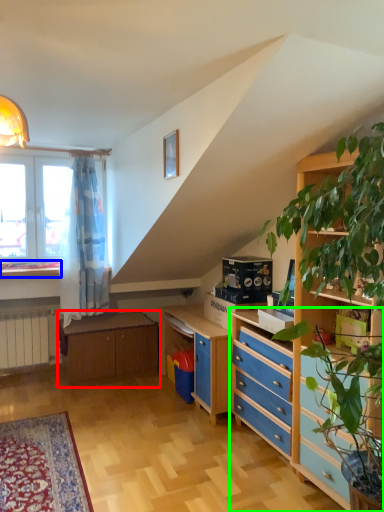
Question: Considering the real-world distances, which object is farthest from table (highlighted by a red box)? window sill (highlighted by a blue box) or chest of drawers (highlighted by a green box)?

Choices:
 (A) window sill
 (B) chest of drawers

Answer: (B)